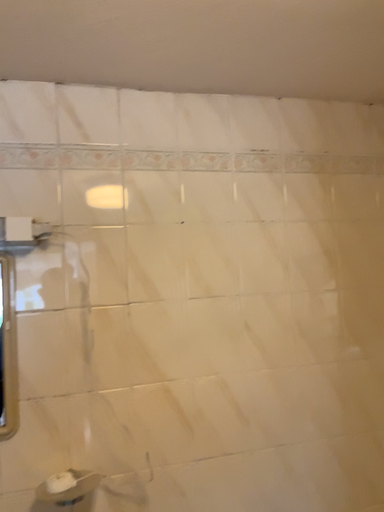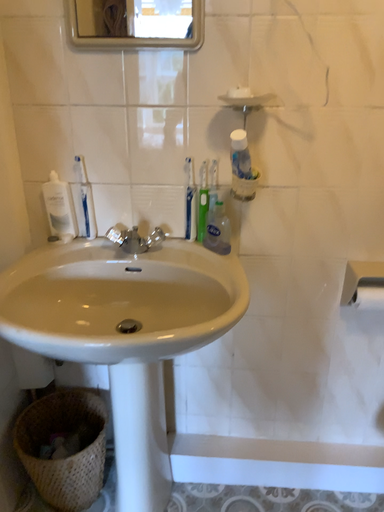
Question: How did the camera likely rotate when shooting the video?

Choices:
 (A) rotated right
 (B) rotated left

Answer: (B)